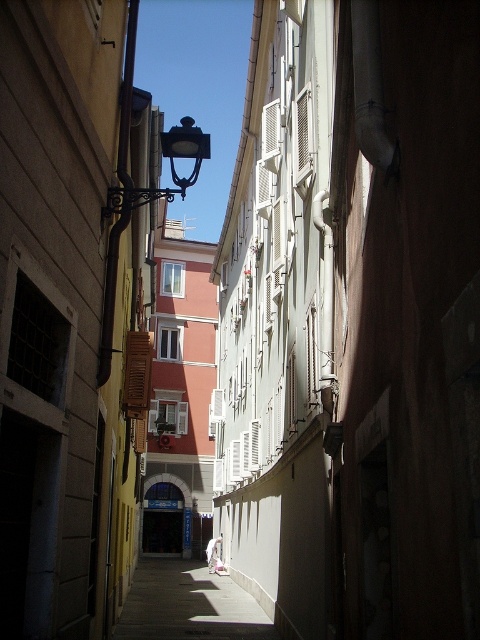
Question: Which of the following is the farthest from the observer?

Choices:
 (A) (271, 637)
 (B) (115, 292)

Answer: (A)

Question: Can you confirm if smooth concrete sidewalk at center is positioned below polished brass streetlamp at upper center?

Choices:
 (A) yes
 (B) no

Answer: (A)

Question: Observing the image, what is the correct spatial positioning of smooth concrete sidewalk at center in reference to polished brass streetlamp at upper center?

Choices:
 (A) below
 (B) above

Answer: (A)

Question: Among these objects, which one is nearest to the camera?

Choices:
 (A) smooth concrete sidewalk at center
 (B) polished brass streetlamp at upper center

Answer: (B)

Question: Can you confirm if smooth concrete sidewalk at center is positioned above polished brass streetlamp at upper center?

Choices:
 (A) no
 (B) yes

Answer: (A)